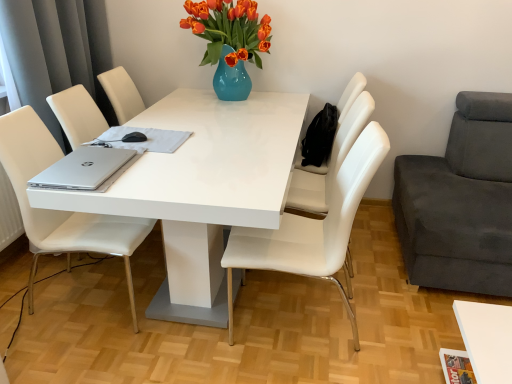
Question: Looking at their shapes, would you say white glossy table at center is wider or thinner than white leather chair at center, placed as the 3th chair when sorted from left to right?

Choices:
 (A) thin
 (B) wide

Answer: (B)

Question: Relative to white leather chair at center, placed as the 3th chair when sorted from left to right, is white glossy table at center in front or behind?

Choices:
 (A) front
 (B) behind

Answer: (A)

Question: Which of these objects is positioned farthest from the white leather chair at left, which is counted as the 4th chair, starting from the right?

Choices:
 (A) dark gray fabric couch at right, the fourth chair in the left-to-right sequence
 (B) silver metallic laptop at left
 (C) white glossy table at center
 (D) white leather chair at center, the 3th chair in the right-to-left sequence
 (E) white cloth at center

Answer: (A)

Question: Based on their relative distances, which object is farther from the silver metallic laptop at left?

Choices:
 (A) white leather chair at center, placed as the 2th chair when sorted from right to left
 (B) dark gray fabric couch at right, the fourth chair in the left-to-right sequence
 (C) white leather chair at center, the 3th chair in the right-to-left sequence
 (D) white glossy table at center
 (E) white leather chair at left, acting as the 1th chair starting from the left

Answer: (B)